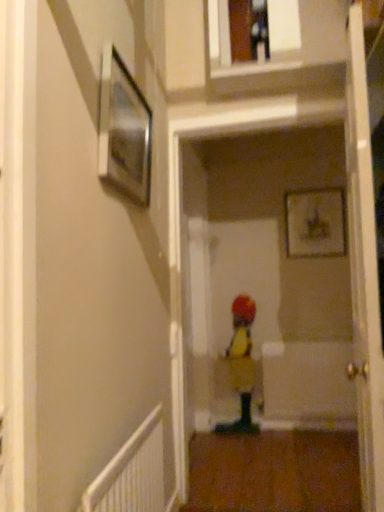
Find the location of a particular element. The width and height of the screenshot is (384, 512). yellow fabric toddler at center is located at coordinates (241, 362).

Where is `metallic silver picture frame at upper left, acting as the second picture frame starting from the right`? metallic silver picture frame at upper left, acting as the second picture frame starting from the right is located at coordinates (124, 130).

From the image's perspective, is metallic silver picture frame at upper left, positioned as the first picture frame in front-to-back order, positioned above or below white textured radiator at lower left?

Clearly, from the image's perspective, metallic silver picture frame at upper left, positioned as the first picture frame in front-to-back order, is above white textured radiator at lower left.

Is metallic silver picture frame at upper left, which is counted as the first picture frame, starting from the left, inside the boundaries of white textured radiator at lower left, or outside?

metallic silver picture frame at upper left, which is counted as the first picture frame, starting from the left, is spatially situated outside white textured radiator at lower left.

Is metallic silver picture frame at upper left, which is counted as the first picture frame, starting from the left, facing towards white textured radiator at lower left?

No, metallic silver picture frame at upper left, which is counted as the first picture frame, starting from the left, does not turn towards white textured radiator at lower left.

How many degrees apart are the facing directions of metallic silver picture frame at upper left, positioned as the first picture frame in front-to-back order, and white textured radiator at lower left?

0.009 degrees separate the facing orientations of metallic silver picture frame at upper left, positioned as the first picture frame in front-to-back order, and white textured radiator at lower left.

Does wooden framed picture at upper center, the second picture frame when ordered from front to back, appear on the right side of white glossy door at center?

Yes.

Is wooden framed picture at upper center, the second picture frame when ordered from front to back, positioned with its back to white glossy door at center?

That's not correct — wooden framed picture at upper center, the second picture frame when ordered from front to back, is not looking away from white glossy door at center.

Image resolution: width=384 pixels, height=512 pixels. Identify the location of the 1st picture frame above when counting from the white glossy door at center (from the image's perspective). (315, 223).

How much distance is there between wooden framed picture at upper center, the second picture frame when ordered from front to back, and white glossy door at center?

wooden framed picture at upper center, the second picture frame when ordered from front to back, is 1.59 meters away from white glossy door at center.

Is point (107, 113) in front of point (354, 278)?

Yes, point (107, 113) is closer to viewer.

Which of these two, metallic silver picture frame at upper left, which appears as the second picture frame when viewed from the back, or white glossy door at center, stands taller?

Standing taller between the two is white glossy door at center.

Is metallic silver picture frame at upper left, which appears as the second picture frame when viewed from the back, positioned far away from white glossy door at center?

metallic silver picture frame at upper left, which appears as the second picture frame when viewed from the back, is actually quite close to white glossy door at center.

This screenshot has width=384, height=512. What are the coordinates of `the 2nd picture frame above when counting from the white glossy door at center (from the image's perspective)` in the screenshot? It's located at (124, 130).

Who is bigger, yellow fabric toddler at center or metallic silver picture frame at upper left, acting as the second picture frame starting from the right?

yellow fabric toddler at center.

In the scene shown: Is there a large distance between yellow fabric toddler at center and metallic silver picture frame at upper left, acting as the second picture frame starting from the right?

yellow fabric toddler at center is far away from metallic silver picture frame at upper left, acting as the second picture frame starting from the right.

Who is shorter, yellow fabric toddler at center or metallic silver picture frame at upper left, positioned as the first picture frame in front-to-back order?

metallic silver picture frame at upper left, positioned as the first picture frame in front-to-back order, is shorter.

You are a GUI agent. You are given a task and a screenshot of the screen. Output one action in this format:
    pyautogui.click(x=<x>, y=<y>)
    Task: Click on the toddler lying on the right of metallic silver picture frame at upper left, which appears as the second picture frame when viewed from the back
    The height and width of the screenshot is (512, 384).
    Given the screenshot: What is the action you would take?
    pyautogui.click(x=241, y=362)

Could you tell me if white textured radiator at lower left is facing wooden framed picture at upper center, which is counted as the 1th picture frame, starting from the back?

No, white textured radiator at lower left is not aimed at wooden framed picture at upper center, which is counted as the 1th picture frame, starting from the back.

From a real-world perspective, is white textured radiator at lower left below wooden framed picture at upper center, the second picture frame when ordered from front to back?

Yes, from a real-world perspective, white textured radiator at lower left is under wooden framed picture at upper center, the second picture frame when ordered from front to back.

Where is `radiator located underneath the wooden framed picture at upper center, the second picture frame when ordered from front to back (from a real-world perspective)`? This screenshot has width=384, height=512. radiator located underneath the wooden framed picture at upper center, the second picture frame when ordered from front to back (from a real-world perspective) is located at coordinates (132, 474).

From the image's perspective, is white textured radiator at lower left above or below wooden framed picture at upper center, marked as the first picture frame in a right-to-left arrangement?

Clearly, from the image's perspective, white textured radiator at lower left is below wooden framed picture at upper center, marked as the first picture frame in a right-to-left arrangement.

Is wooden framed picture at upper center, which is counted as the 1th picture frame, starting from the back, facing away from yellow fabric toddler at center?

No, wooden framed picture at upper center, which is counted as the 1th picture frame, starting from the back, is not facing the opposite direction of yellow fabric toddler at center.

Does wooden framed picture at upper center, marked as the first picture frame in a right-to-left arrangement, touch yellow fabric toddler at center?

wooden framed picture at upper center, marked as the first picture frame in a right-to-left arrangement, and yellow fabric toddler at center are not in contact.

Where is `toddler in front of the wooden framed picture at upper center, which is counted as the 1th picture frame, starting from the back`? toddler in front of the wooden framed picture at upper center, which is counted as the 1th picture frame, starting from the back is located at coordinates (241, 362).

From their relative heights in the image, would you say wooden framed picture at upper center, the second picture frame when ordered from left to right, is taller or shorter than yellow fabric toddler at center?

wooden framed picture at upper center, the second picture frame when ordered from left to right, is shorter than yellow fabric toddler at center.

Is white textured radiator at lower left positioned with its back to metallic silver picture frame at upper left, which is counted as the first picture frame, starting from the left?

No, metallic silver picture frame at upper left, which is counted as the first picture frame, starting from the left, is not at the back of white textured radiator at lower left.

Which is behind, white textured radiator at lower left or metallic silver picture frame at upper left, positioned as the first picture frame in front-to-back order?

Positioned behind is metallic silver picture frame at upper left, positioned as the first picture frame in front-to-back order.

From a real-world perspective, is white textured radiator at lower left physically below metallic silver picture frame at upper left, which appears as the second picture frame when viewed from the back?

Yes.

What are the coordinates of `picture frame that is on the left side of white textured radiator at lower left` in the screenshot? It's located at coord(124,130).

From a real-world perspective, which picture frame is the 1st one above the white glossy door at center? Please provide its 2D coordinates.

[(315, 223)]

Based on their spatial positions, is metallic silver picture frame at upper left, positioned as the first picture frame in front-to-back order, or wooden framed picture at upper center, which is counted as the 1th picture frame, starting from the back, further from white textured radiator at lower left?

Among the two, wooden framed picture at upper center, which is counted as the 1th picture frame, starting from the back, is located further to white textured radiator at lower left.

Which object lies nearer to the anchor point yellow fabric toddler at center, metallic silver picture frame at upper left, acting as the second picture frame starting from the right, or white textured radiator at lower left?

The object closer to yellow fabric toddler at center is white textured radiator at lower left.

From the picture: From the image, which object appears to be nearer to yellow fabric toddler at center, white textured radiator at lower left or white glossy door at center?

white glossy door at center is positioned closer to the anchor yellow fabric toddler at center.

Looking at the image, which one is located further to yellow fabric toddler at center, wooden framed picture at upper center, marked as the first picture frame in a right-to-left arrangement, or white textured radiator at lower left?

Among the two, white textured radiator at lower left is located further to yellow fabric toddler at center.

Considering their positions, is yellow fabric toddler at center positioned further to white glossy door at center than white textured radiator at lower left?

yellow fabric toddler at center lies further to white glossy door at center than the other object.

From the image, which object appears to be farther from yellow fabric toddler at center, white glossy door at center or metallic silver picture frame at upper left, which appears as the second picture frame when viewed from the back?

The object further to yellow fabric toddler at center is metallic silver picture frame at upper left, which appears as the second picture frame when viewed from the back.

Estimate the real-world distances between objects in this image. Which object is closer to white textured radiator at lower left, yellow fabric toddler at center or white glossy door at center?

The object closer to white textured radiator at lower left is white glossy door at center.

Consider the image. Considering their positions, is yellow fabric toddler at center positioned further to wooden framed picture at upper center, the second picture frame when ordered from front to back, than white textured radiator at lower left?

Based on the image, white textured radiator at lower left appears to be further to wooden framed picture at upper center, the second picture frame when ordered from front to back.

Find the location of `door located between white textured radiator at lower left and wooden framed picture at upper center, marked as the first picture frame in a right-to-left arrangement, in the depth direction`. door located between white textured radiator at lower left and wooden framed picture at upper center, marked as the first picture frame in a right-to-left arrangement, in the depth direction is located at coordinates (364, 270).

Where is `toddler between white textured radiator at lower left and wooden framed picture at upper center, which is counted as the 1th picture frame, starting from the back, in the front-back direction`? toddler between white textured radiator at lower left and wooden framed picture at upper center, which is counted as the 1th picture frame, starting from the back, in the front-back direction is located at coordinates (241, 362).

I want to click on picture frame positioned between white textured radiator at lower left and yellow fabric toddler at center from near to far, so click(x=124, y=130).

Identify the location of picture frame between white glossy door at center and wooden framed picture at upper center, marked as the first picture frame in a right-to-left arrangement, from front to back. (124, 130).